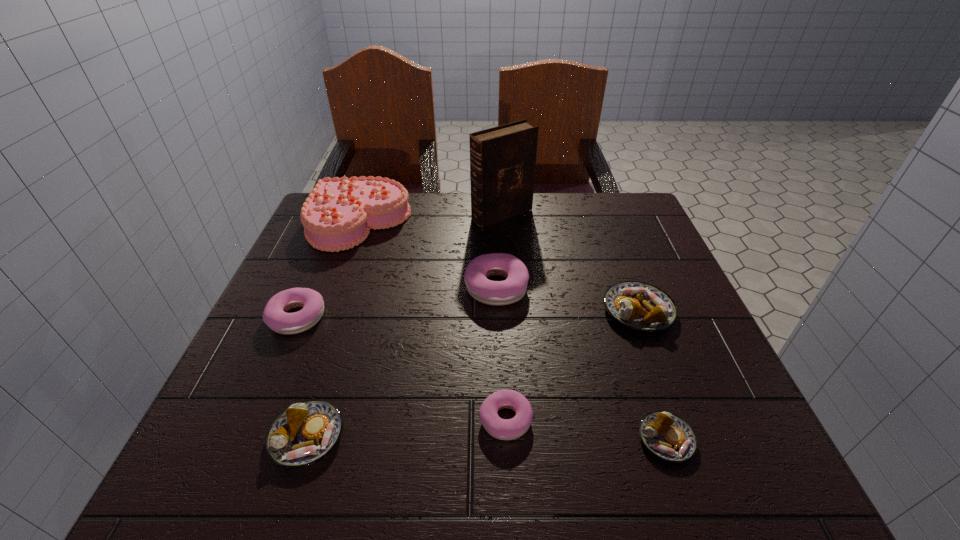
Where is `object that is at the near left corner`? object that is at the near left corner is located at coordinates (306, 432).

The image size is (960, 540). I want to click on object located at the near right corner, so click(x=667, y=436).

Find the location of a particular element. vacant space at the far edge of the desktop is located at coordinates (536, 235).

Find the location of a particular element. This screenshot has height=540, width=960. vacant point at the near edge is located at coordinates (644, 469).

Where is `free region at the left edge of the desktop`? free region at the left edge of the desktop is located at coordinates (244, 361).

In the image, there is a desktop. Where is `vacant space at the right edge`? vacant space at the right edge is located at coordinates (642, 333).

You are a GUI agent. You are given a task and a screenshot of the screen. Output one action in this format:
    pyautogui.click(x=<x>, y=<y>)
    Task: Click on the free space at the near left corner of the desktop
    The image size is (960, 540).
    Given the screenshot: What is the action you would take?
    pyautogui.click(x=269, y=458)

At what (x,y) coordinates should I click in order to perform the action: click on vacant point at the far right corner. Please return your answer as a coordinate pair (x, y). This screenshot has height=540, width=960. Looking at the image, I should click on (624, 235).

The height and width of the screenshot is (540, 960). I want to click on blank space at the near right corner of the desktop, so click(x=765, y=441).

This screenshot has width=960, height=540. Identify the location of free space between the leftmost pink pastry and the Bible. (399, 266).